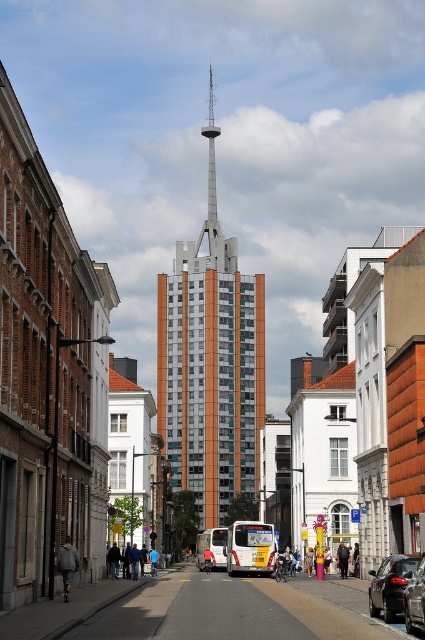
Question: Which object is closer to the camera taking this photo?

Choices:
 (A) shiny black car at lower right
 (B) dark blue jacket at center

Answer: (A)

Question: Is shiny black car at lower right to the left of shiny black sedan at center from the viewer's perspective?

Choices:
 (A) no
 (B) yes

Answer: (A)

Question: Among these points, which one is nearest to the camera?

Choices:
 (A) (227, 349)
 (B) (408, 589)
 (C) (73, 561)

Answer: (B)

Question: Which point is farther to the camera?

Choices:
 (A) shiny black car at lower right
 (B) blue cotton shirt at center

Answer: (B)

Question: Does shiny black car at lower right have a greater width compared to light brown leather jacket at center?

Choices:
 (A) no
 (B) yes

Answer: (B)

Question: Does green glass tower at center have a larger size compared to gray fabric jacket at lower left?

Choices:
 (A) no
 (B) yes

Answer: (B)